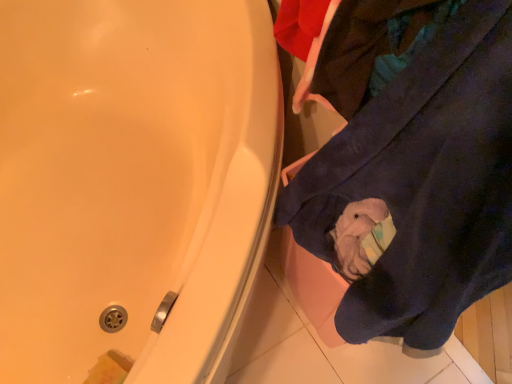
Question: Is navy blue towel at lower right oriented towards matte white bathtub at upper left?

Choices:
 (A) yes
 (B) no

Answer: (B)

Question: Does navy blue towel at lower right appear on the right side of matte white bathtub at upper left?

Choices:
 (A) no
 (B) yes

Answer: (B)

Question: Is navy blue towel at lower right shorter than matte white bathtub at upper left?

Choices:
 (A) no
 (B) yes

Answer: (A)

Question: Is navy blue towel at lower right surrounding matte white bathtub at upper left?

Choices:
 (A) no
 (B) yes

Answer: (A)

Question: Is navy blue towel at lower right closer to camera compared to matte white bathtub at upper left?

Choices:
 (A) no
 (B) yes

Answer: (B)

Question: Is navy blue towel at lower right thinner than matte white bathtub at upper left?

Choices:
 (A) no
 (B) yes

Answer: (B)

Question: Is matte white bathtub at upper left bigger than navy blue towel at lower right?

Choices:
 (A) no
 (B) yes

Answer: (B)

Question: Can you confirm if matte white bathtub at upper left is wider than navy blue towel at lower right?

Choices:
 (A) no
 (B) yes

Answer: (B)

Question: Can you confirm if matte white bathtub at upper left is taller than navy blue towel at lower right?

Choices:
 (A) yes
 (B) no

Answer: (B)

Question: Can you confirm if matte white bathtub at upper left is positioned to the right of navy blue towel at lower right?

Choices:
 (A) yes
 (B) no

Answer: (B)

Question: Is the depth of matte white bathtub at upper left less than that of navy blue towel at lower right?

Choices:
 (A) no
 (B) yes

Answer: (A)

Question: From a real-world perspective, is matte white bathtub at upper left positioned over navy blue towel at lower right based on gravity?

Choices:
 (A) yes
 (B) no

Answer: (B)

Question: From the image's perspective, is matte white bathtub at upper left located above or below navy blue towel at lower right?

Choices:
 (A) below
 (B) above

Answer: (B)